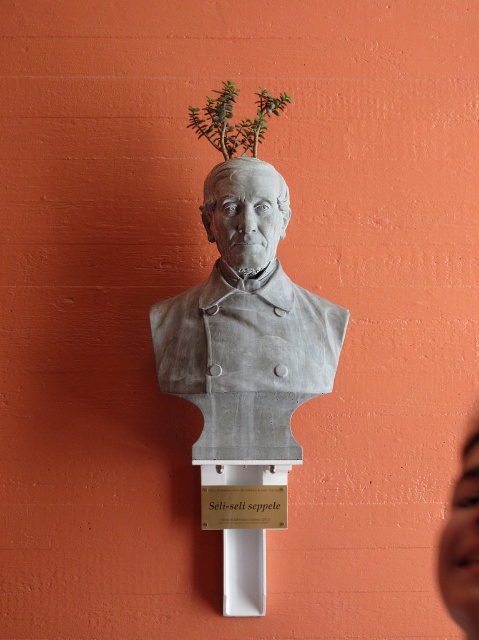
Question: Is smooth skin face at upper right below green leafy plant at upper center?

Choices:
 (A) yes
 (B) no

Answer: (A)

Question: Based on their relative distances, which object is nearer to the smooth skin face at upper right?

Choices:
 (A) gray stone bust at center
 (B) green leafy plant at upper center

Answer: (A)

Question: Is green leafy plant at upper center in front of matte white sign at center?

Choices:
 (A) yes
 (B) no

Answer: (A)

Question: Which object appears closest to the camera in this image?

Choices:
 (A) smooth skin face at upper right
 (B) matte white sign at center

Answer: (A)

Question: Is the position of gray stone bust at center less distant than that of green leafy plant at upper center?

Choices:
 (A) no
 (B) yes

Answer: (B)

Question: Among these points, which one is nearest to the camera?

Choices:
 (A) (265, 502)
 (B) (468, 445)

Answer: (B)